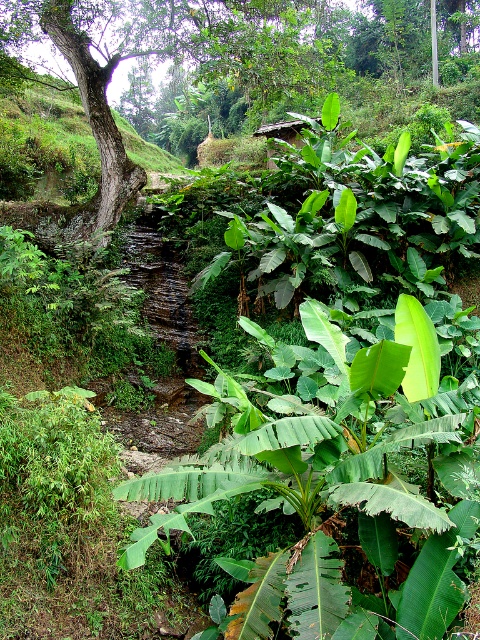
You are standing at the origin point in the image. Which direction should you move to reach the green leafy banana tree at center?

The green leafy banana tree at center is located at coordinates approximately 0.753 on the x axis and 0.708 on the y axis. Since you are at the origin point, you should move towards the right and slightly upward to reach it.

You are standing at the point marked as point (371, 612) in the lush tropical landscape. A friend is standing at the same point. How far apart are you and your friend?

You and your friend are at the same point, so the distance between you and your friend is 0 meters.

Looking at this image, you are a hiker who needs to cross the stream in the image. You have a 10 feet long wooden plank. The stream is between the green leafy banana tree at center and the green leafy tree at center. Can you safely place the plank to cross the stream?

The distance between the green leafy banana tree at center and the green leafy tree at center is 39.33 feet. Since the plank is only 10 feet long, it is not long enough to span the gap between them. Therefore, you cannot safely place the plank to cross the stream.